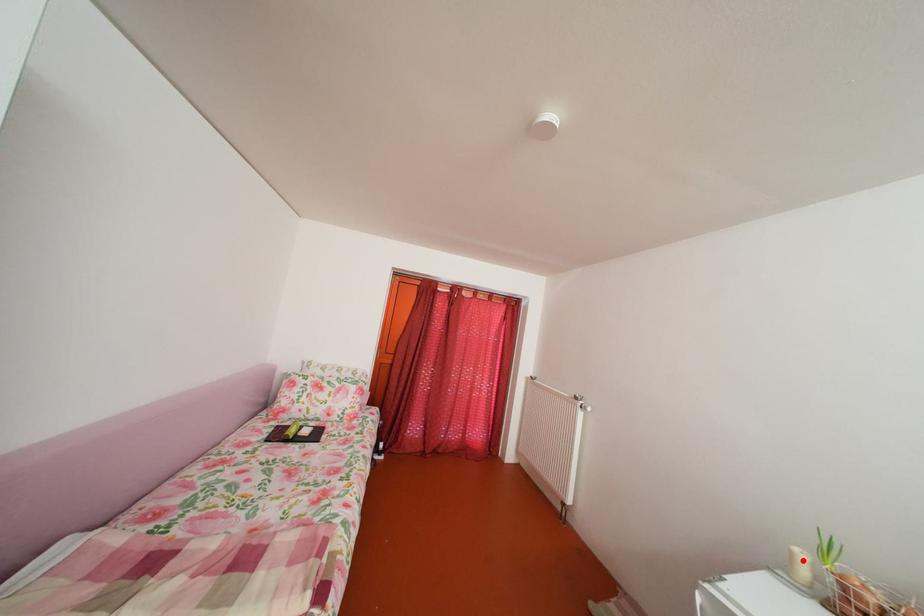
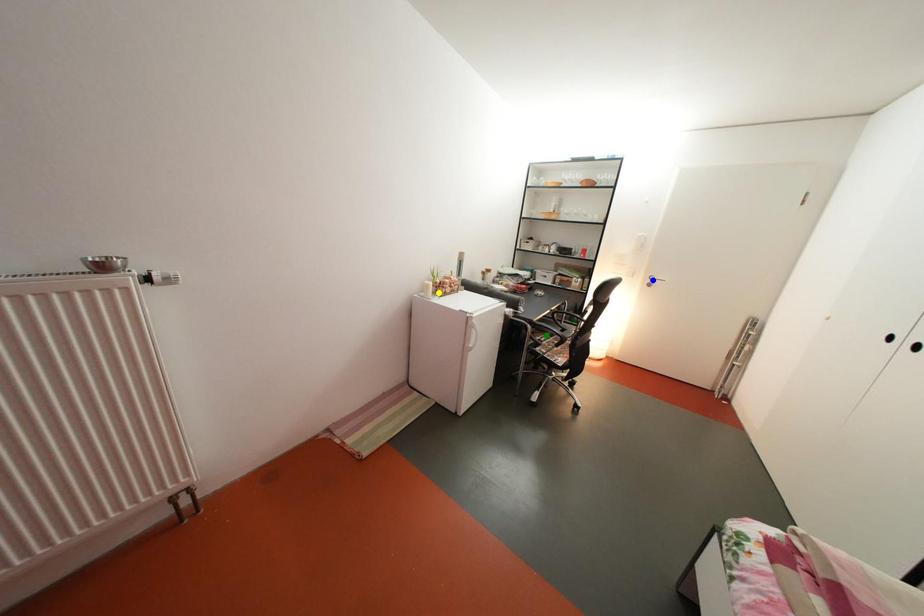
Question: I am providing you with two images of the same scene from different viewpoints. A red point is marked on the first image. You are given multiple points on the second image. Which mark in image 2 goes with the point in image 1?

Choices:
 (A) blue point
 (B) green point
 (C) yellow point

Answer: (C)